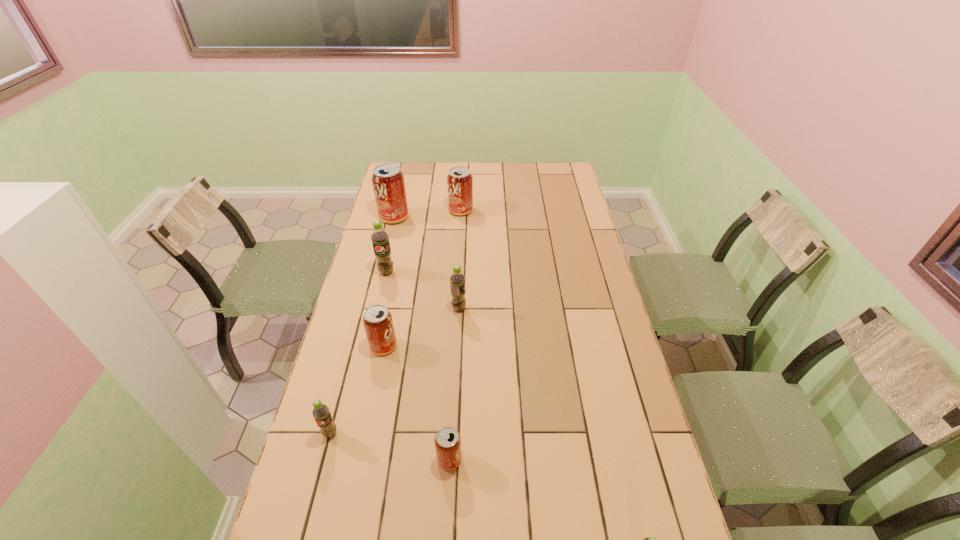
The image size is (960, 540). What are the coordinates of `the seventh farthest soda` in the screenshot? It's located at (447, 441).

Find the location of a particular element. This screenshot has height=540, width=960. the seventh farthest object is located at coordinates (447, 441).

The height and width of the screenshot is (540, 960). I want to click on free space located 0.130m on the right of the biggest red soda can, so click(439, 217).

Find the location of `free space located on the front label of the sixth nearest soda`. free space located on the front label of the sixth nearest soda is located at coordinates (376, 318).

Where is `free space located on the right of the third smallest red soda can`? The height and width of the screenshot is (540, 960). free space located on the right of the third smallest red soda can is located at coordinates (561, 211).

The image size is (960, 540). I want to click on vacant space located 0.230m on the front label of the third green soda from left to right, so click(533, 308).

The width and height of the screenshot is (960, 540). Find the location of `free region located 0.260m on the back of the fifth farthest object`. free region located 0.260m on the back of the fifth farthest object is located at coordinates (396, 281).

Identify the location of vacant space located on the front label of the third nearest soda. (307, 523).

The image size is (960, 540). I want to click on blank space located on the right of the nearest red soda can, so click(x=609, y=459).

In the image, there is a desktop. Where is `free region at the far edge`? free region at the far edge is located at coordinates (516, 180).